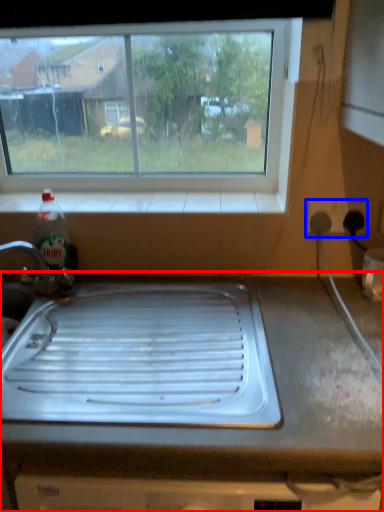
Question: Which of the following is the closest to the observer, countertop (highlighted by a red box) or electric outlet (highlighted by a blue box)?

Choices:
 (A) countertop
 (B) electric outlet

Answer: (A)